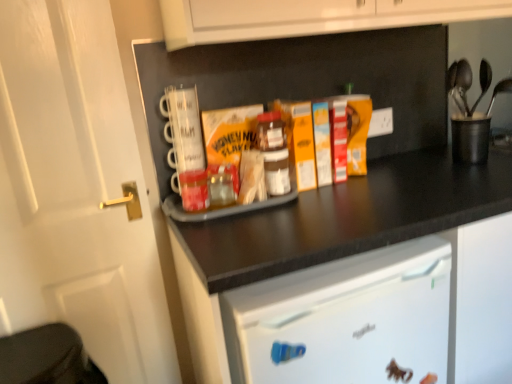
In order to click on black plastic utensil holder at upper right in this screenshot , I will do `click(470, 138)`.

This screenshot has height=384, width=512. Describe the element at coordinates (470, 138) in the screenshot. I see `black plastic utensil holder at upper right` at that location.

Describe the element at coordinates (348, 218) in the screenshot. I see `black matte tray at center` at that location.

Where is `black plastic utensil holder at upper right`? black plastic utensil holder at upper right is located at coordinates (470, 138).

The height and width of the screenshot is (384, 512). What are the coordinates of `door below the black plastic utensil holder at upper right (from a real-world perspective)` in the screenshot? It's located at (77, 192).

Is black plastic utensil holder at upper right at the back of white matte door at left?

No.

Can you confirm if white matte door at left is shorter than black plastic utensil holder at upper right?

No, white matte door at left is not shorter than black plastic utensil holder at upper right.

Looking at this image, which object is further away from the camera, white matte door at left or black plastic utensil holder at upper right?

black plastic utensil holder at upper right is further from the camera.

Does black plastic utensil holder at upper right have a lesser width compared to black matte tray at center?

Indeed, black plastic utensil holder at upper right has a lesser width compared to black matte tray at center.

Is black plastic utensil holder at upper right spatially inside black matte tray at center, or outside of it?

black plastic utensil holder at upper right is outside black matte tray at center.

Is the surface of black plastic utensil holder at upper right in direct contact with black matte tray at center?

They are not placed beside each other.

Is the position of black plastic utensil holder at upper right more distant than that of black matte tray at center?

Yes, black plastic utensil holder at upper right is further from the camera.

Considering the sizes of objects white matte door at left and black matte tray at center in the image provided, who is smaller, white matte door at left or black matte tray at center?

Smaller between the two is white matte door at left.

In the scene shown: From the image's perspective, which is above, white matte door at left or black matte tray at center?

white matte door at left.

Are white matte door at left and black matte tray at center beside each other?

white matte door at left is not next to black matte tray at center, and they're not touching.

Is white matte door at left closer to the viewer compared to black matte tray at center?

No, it is not.

Does black plastic utensil holder at upper right appear on the left side of translucent plastic jar at center?

No, black plastic utensil holder at upper right is not to the left of translucent plastic jar at center.

Could you tell me if black plastic utensil holder at upper right is turned towards translucent plastic jar at center?

No, black plastic utensil holder at upper right is not facing towards translucent plastic jar at center.

Considering the relative sizes of black plastic utensil holder at upper right and translucent plastic jar at center in the image provided, is black plastic utensil holder at upper right bigger than translucent plastic jar at center?

Yes.

How different are the orientations of black plastic utensil holder at upper right and translucent plastic jar at center in degrees?

black plastic utensil holder at upper right and translucent plastic jar at center are facing 0.00245 degrees away from each other.

Does black matte tray at center turn towards white matte door at left?

No, black matte tray at center is not aimed at white matte door at left.

Considering the positions of objects black matte tray at center and white matte door at left in the image provided, who is more to the right, black matte tray at center or white matte door at left?

black matte tray at center.

Are black matte tray at center and white matte door at left making contact?

No.

Is the depth of black matte tray at center less than that of white matte door at left?

Yes.

Is white matte door at left directly adjacent to translucent plastic jar at center?

No, white matte door at left is not next to translucent plastic jar at center.

Is point (78, 91) closer to camera compared to point (276, 135)?

Yes.

The height and width of the screenshot is (384, 512). Find the location of `bottle above the white matte door at left (from the image's perspective)`. bottle above the white matte door at left (from the image's perspective) is located at coordinates (274, 152).

From a real-world perspective, which is physically above, black matte tray at center or black plastic utensil holder at upper right?

black plastic utensil holder at upper right, from a real-world perspective.

Is black plastic utensil holder at upper right a part of black matte tray at center?

No, black plastic utensil holder at upper right is not inside black matte tray at center.

Considering the relative sizes of black matte tray at center and black plastic utensil holder at upper right in the image provided, is black matte tray at center bigger than black plastic utensil holder at upper right?

Yes.

Which is behind, point (369, 194) or point (471, 125)?

Positioned behind is point (471, 125).

You are a GUI agent. You are given a task and a screenshot of the screen. Output one action in this format:
    pyautogui.click(x=<x>, y=<y>)
    Task: Click on the appliance that is on the right side of white matte door at left
    
    Given the screenshot: What is the action you would take?
    pyautogui.click(x=470, y=138)

Locate an element on the screen. appliance above the black matte tray at center (from the image's perspective) is located at coordinates (470, 138).

In the scene shown: From the image, which object appears to be nearer to white matte door at left, black plastic utensil holder at upper right or translucent plastic jar at center?

The object closer to white matte door at left is translucent plastic jar at center.

Looking at the image, which one is located closer to white matte door at left, translucent plastic jar at center or black plastic utensil holder at upper right?

translucent plastic jar at center is positioned closer to the anchor white matte door at left.

When comparing their distances from white matte door at left, does black matte tray at center or translucent plastic jar at center seem further?

black matte tray at center lies further to white matte door at left than the other object.

When comparing their distances from black matte tray at center, does translucent plastic jar at center or black plastic utensil holder at upper right seem closer?

The object closer to black matte tray at center is translucent plastic jar at center.

Considering their positions, is black plastic utensil holder at upper right positioned closer to black matte tray at center than white matte door at left?

Among the two, black plastic utensil holder at upper right is located nearer to black matte tray at center.

Which object lies nearer to the anchor point black matte tray at center, black plastic utensil holder at upper right or translucent plastic jar at center?

The object closer to black matte tray at center is translucent plastic jar at center.

Looking at this image, estimate the real-world distances between objects in this image. Which object is closer to white matte door at left, black matte tray at center or black plastic utensil holder at upper right?

Among the two, black matte tray at center is located nearer to white matte door at left.

Estimate the real-world distances between objects in this image. Which object is closer to translucent plastic jar at center, white matte door at left or black matte tray at center?

black matte tray at center is positioned closer to the anchor translucent plastic jar at center.

Where is `countertop located between white matte door at left and black plastic utensil holder at upper right in the left-right direction`? This screenshot has height=384, width=512. countertop located between white matte door at left and black plastic utensil holder at upper right in the left-right direction is located at coordinates (348, 218).

The image size is (512, 384). Identify the location of bottle between white matte door at left and black matte tray at center. (274, 152).

Locate an element on the screen. bottle between white matte door at left and black plastic utensil holder at upper right is located at coordinates (274, 152).

Locate an element on the screen. The height and width of the screenshot is (384, 512). countertop between translucent plastic jar at center and black plastic utensil holder at upper right from left to right is located at coordinates (348, 218).